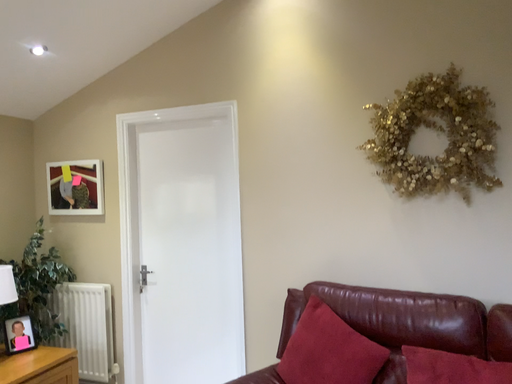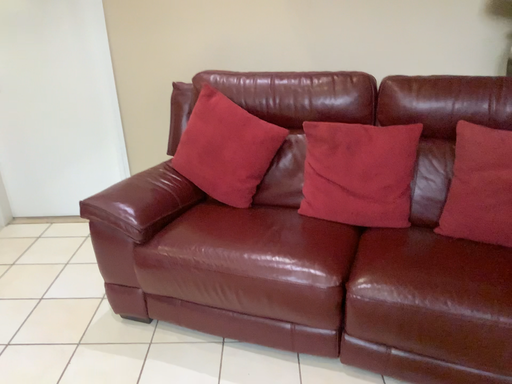
Question: How did the camera likely rotate when shooting the video?

Choices:
 (A) rotated upward
 (B) rotated downward

Answer: (B)